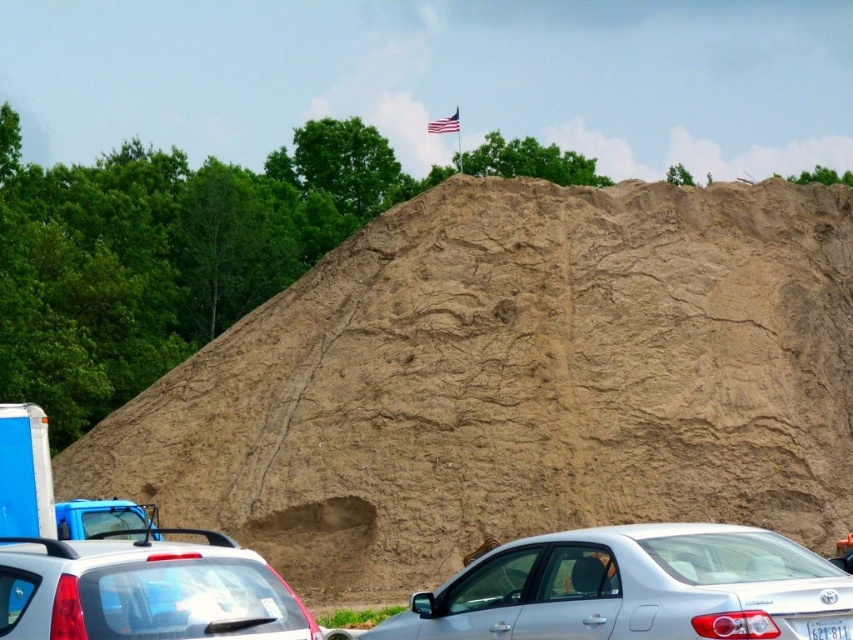
Is satin silver sedan at center taller than white plastic license plate at lower right?

Yes, satin silver sedan at center is taller than white plastic license plate at lower right.

Is satin silver sedan at center to the left of white plastic license plate at lower right from the viewer's perspective?

Yes, satin silver sedan at center is to the left of white plastic license plate at lower right.

Is point (834, 616) positioned in front of point (833, 618)?

Yes, point (834, 616) is in front of point (833, 618).

Identify the location of satin silver sedan at center. (631, 588).

From the picture: Is satin silver sedan at center shorter than american flag at upper center?

In fact, satin silver sedan at center may be taller than american flag at upper center.

Does satin silver sedan at center appear on the left side of american flag at upper center?

No, satin silver sedan at center is not to the left of american flag at upper center.

At what (x,y) coordinates should I click in order to perform the action: click on satin silver sedan at center. Please return your answer as a coordinate pair (x, y). The image size is (853, 640). Looking at the image, I should click on (631, 588).

Does point (250, 620) come closer to viewer compared to point (845, 627)?

Yes, it is.

Who is higher up, white matte hatchback at lower left or white plastic license plate at lower right?

white matte hatchback at lower left is higher up.

Is point (172, 556) positioned in front of point (814, 620)?

Yes, point (172, 556) is closer to viewer.

Identify the location of white matte hatchback at lower left. This screenshot has width=853, height=640. (144, 593).